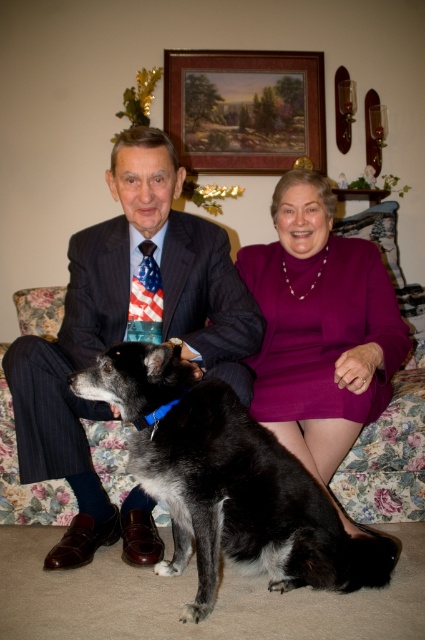
Question: Does matte black dress at center lie in front of black fur dog at center?

Choices:
 (A) no
 (B) yes

Answer: (A)

Question: Which object is the farthest from the wooden framed painting at upper center?

Choices:
 (A) purple satin dress at center
 (B) black fur dog at center
 (C) matte black dress at center

Answer: (B)

Question: Which of these objects is positioned farthest from the matte black dress at center?

Choices:
 (A) purple satin dress at center
 (B) black fur dog at center
 (C) wooden framed painting at upper center

Answer: (C)

Question: Observing the image, what is the correct spatial positioning of matte black dress at center in reference to wooden framed painting at upper center?

Choices:
 (A) above
 (B) below

Answer: (B)

Question: Which is nearer to the matte black dress at center?

Choices:
 (A) wooden framed painting at upper center
 (B) black fur dog at center

Answer: (B)

Question: Is black fur dog at center bigger than wooden framed painting at upper center?

Choices:
 (A) no
 (B) yes

Answer: (B)